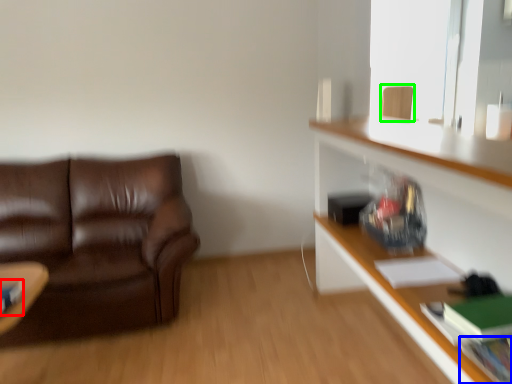
Question: Based on their relative distances, which object is nearer to book (highlighted by a red box)? Choose from book (highlighted by a blue box) and swivel chair (highlighted by a green box).

Choices:
 (A) book
 (B) swivel chair

Answer: (A)